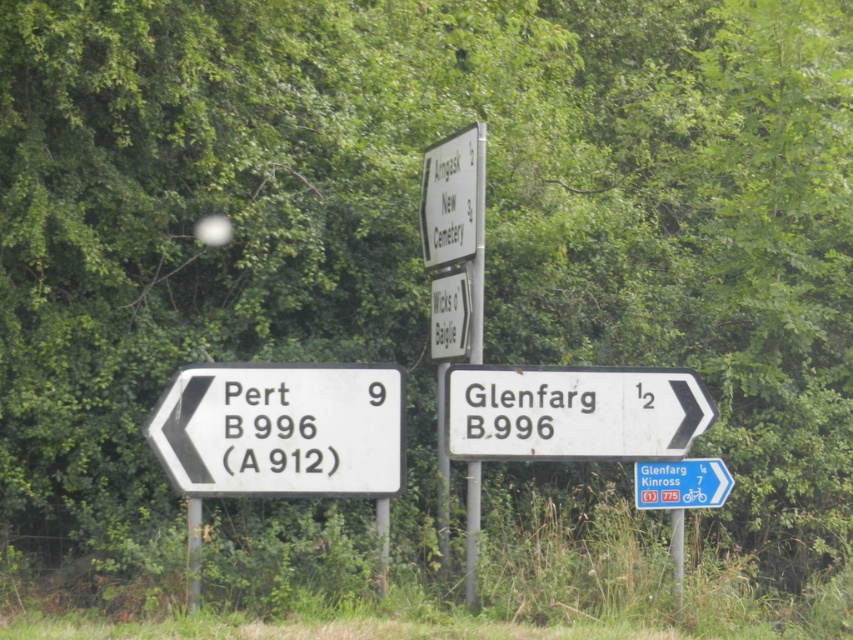
Question: Among these objects, which one is nearest to the camera?

Choices:
 (A) white plastic sign at upper center
 (B) white plastic sign at center right

Answer: (B)

Question: Is white plastic signpost at center below blue plastic sign at center?

Choices:
 (A) no
 (B) yes

Answer: (A)

Question: Which point is closer to the camera taking this photo?

Choices:
 (A) (688, 465)
 (B) (480, 355)
 (C) (672, 432)

Answer: (B)

Question: Does white plastic sign at left have a lesser width compared to white plastic signpost at center?

Choices:
 (A) no
 (B) yes

Answer: (A)

Question: Which of these objects is positioned closest to the white plastic sign at left?

Choices:
 (A) blue plastic sign at center
 (B) white plastic signpost at center
 (C) white plastic sign at upper center

Answer: (B)

Question: Where is white plastic sign at center right located in relation to blue plastic sign at center in the image?

Choices:
 (A) left
 (B) right

Answer: (A)